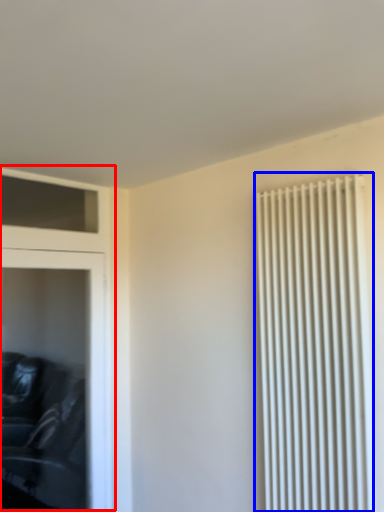
Question: Which of the following is the farthest to the observer, dresser (highlighted by a red box) or radiator (highlighted by a blue box)?

Choices:
 (A) dresser
 (B) radiator

Answer: (A)